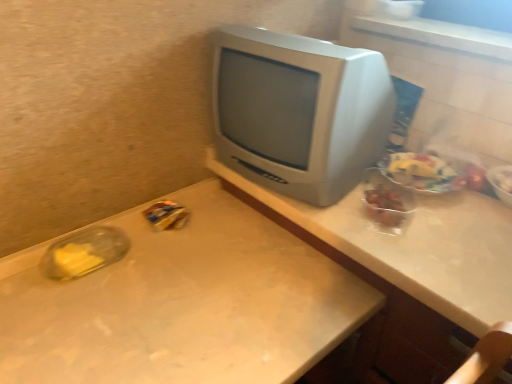
Locate an element on the screen. The image size is (512, 384). free space above matte gray computer desk at center (from a real-world perspective) is located at coordinates (444, 223).